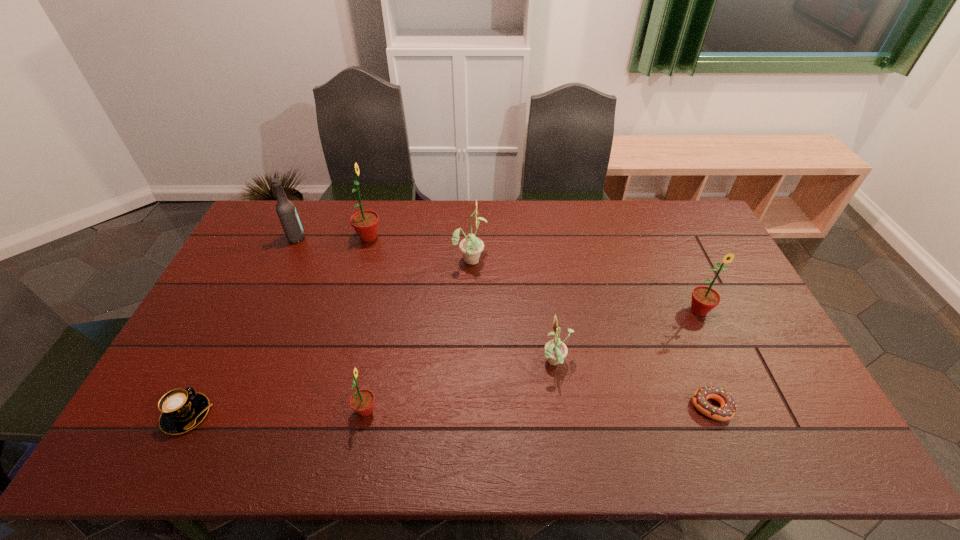
Identify the location of object located in the right edge section of the desktop. The height and width of the screenshot is (540, 960). (704, 299).

Identify the location of object at the far left corner. This screenshot has width=960, height=540. (286, 211).

Locate an element on the screen. The width and height of the screenshot is (960, 540). object that is at the near left corner is located at coordinates (181, 410).

At what (x,y) coordinates should I click in order to perform the action: click on vacant space at the far edge of the desktop. Please return your answer as a coordinate pair (x, y). This screenshot has width=960, height=540. Looking at the image, I should click on (502, 219).

Identify the location of vacant space at the left edge. This screenshot has height=540, width=960. point(224,322).

In the image, there is a desktop. Where is `vacant space at the right edge`? The width and height of the screenshot is (960, 540). vacant space at the right edge is located at coordinates (778, 368).

Where is `vacant area between the fourth nearest object and the cappuccino`? vacant area between the fourth nearest object and the cappuccino is located at coordinates (372, 389).

The height and width of the screenshot is (540, 960). Identify the location of blank region between the leftmost sunflower and the doughnut. (540, 322).

Locate an element on the screen. The height and width of the screenshot is (540, 960). free space between the biggest green sunflower and the rightmost green sunflower is located at coordinates (534, 274).

The image size is (960, 540). In order to click on free spot between the fourth object from right to left and the smallest green sunflower in this screenshot , I will do `click(418, 335)`.